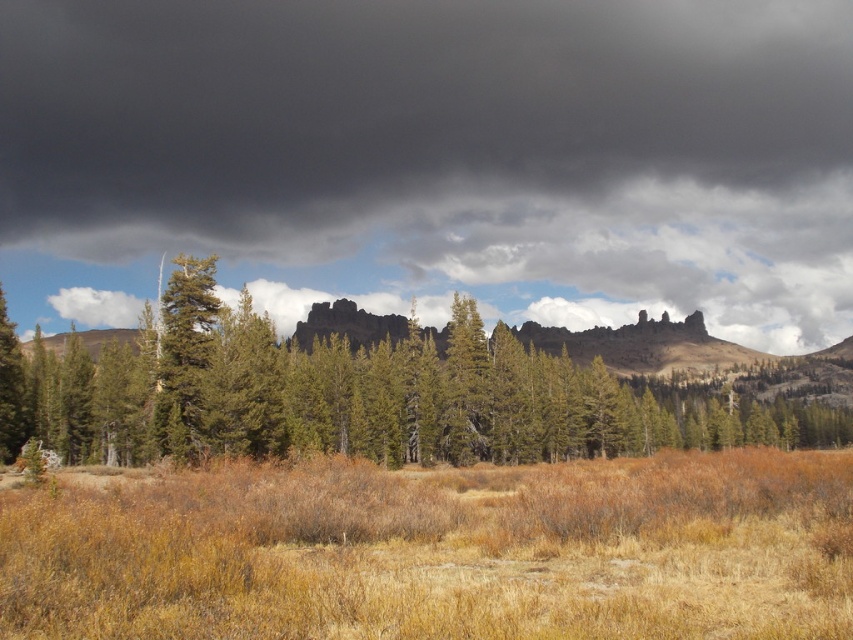
You are standing in the field of dry grass and looking at the dark gray cloud at upper center and the green matte tree at center. Which object is positioned to the left of the other?

The dark gray cloud at upper center is positioned to the left of the green matte tree at center.

You are standing in the middle of the field of dry, golden brown grasses and shrubs in the foreground of the landscape. You notice a dense cluster of evergreen trees in the middle ground. If you walk straight ahead, will you reach the dense cluster of evergreen trees before the point represented by point (x=440, y=552)?

The point (x=440, y=552) corresponds to the brown dry grass at center. Since you are already in the field of dry grasses and shrubs in the foreground, walking straight ahead would first encounter the dense cluster of evergreen trees in the middle ground before reaching the point (x=440, y=552) located further ahead in the center.

You are an observer looking at the landscape. You notice the dark gray cloud at upper center and the brown dry grass at center. Which object is positioned to the right when comparing their locations?

The dark gray cloud at upper center is positioned to the right of the brown dry grass at center.